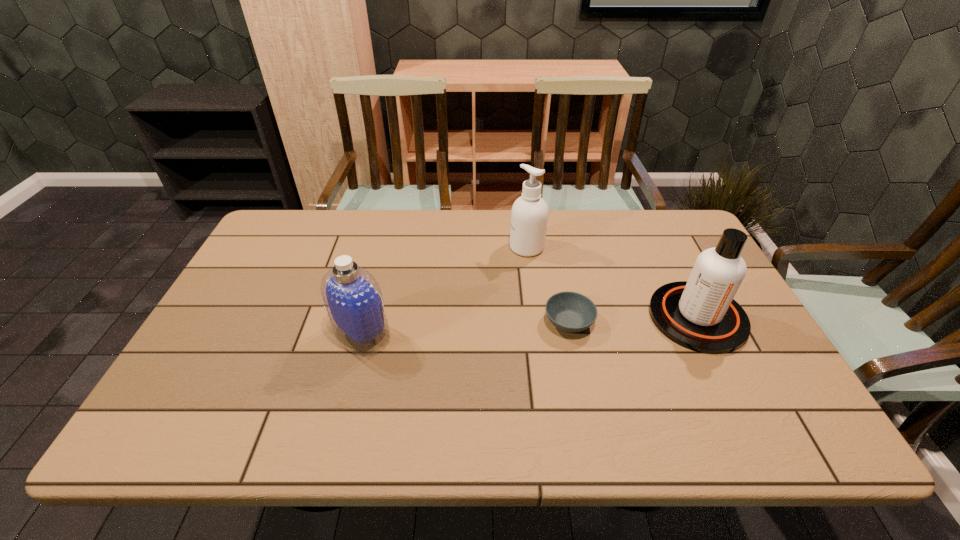
Find the location of `the farthest cleansing agent`. the farthest cleansing agent is located at coordinates (529, 215).

Find the location of a particular element. This screenshot has height=540, width=960. the second cleansing agent from right to left is located at coordinates click(x=529, y=215).

Where is `the rightmost object`? The image size is (960, 540). the rightmost object is located at coordinates (700, 314).

Identify the location of the leftmost cleansing agent. (353, 299).

What are the coordinates of `soup bowl` in the screenshot? It's located at [571, 312].

Identify the location of vacant area situated on the front label of the farthest cleansing agent. The width and height of the screenshot is (960, 540). (478, 247).

Identify the location of free region located on the front label of the farthest cleansing agent. This screenshot has width=960, height=540. (456, 247).

Where is `free region located 0.170m on the front label of the farthest cleansing agent`? The image size is (960, 540). free region located 0.170m on the front label of the farthest cleansing agent is located at coordinates (456, 247).

This screenshot has height=540, width=960. Find the location of `free point located on the left of the rightmost object`. free point located on the left of the rightmost object is located at coordinates (617, 317).

Find the location of a particular element. The width and height of the screenshot is (960, 540). vacant space located 0.270m on the back of the leftmost object is located at coordinates (384, 251).